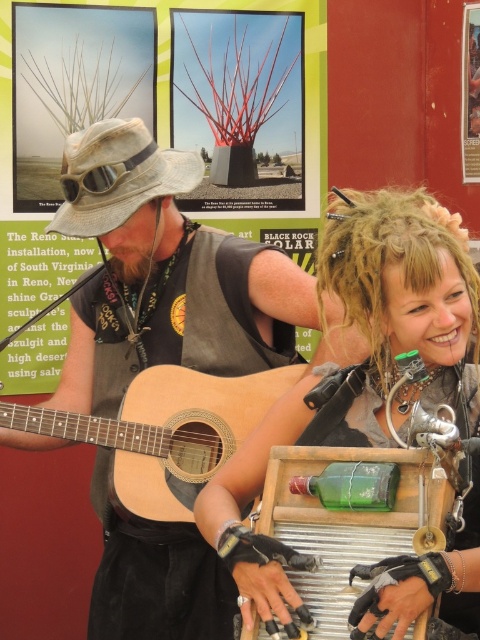
Between point (142, 122) and point (144, 161), which one is positioned behind?

The point (142, 122) is more distant.

Which is more to the left, light brown straw hat at center or matte black goggles at center?

From the viewer's perspective, light brown straw hat at center appears more on the left side.

Which is behind, point (130, 204) or point (134, 192)?

Point (134, 192)

Find the location of a particular element. Image resolution: width=480 pixels, height=640 pixels. light brown straw hat at center is located at coordinates (117, 177).

Is natural wood acoustic guitar at center above matte black goggles at center?

No, natural wood acoustic guitar at center is not above matte black goggles at center.

Between natural wood acoustic guitar at center and matte black goggles at center, which one is positioned higher?

matte black goggles at center is above.

You are a GUI agent. You are given a task and a screenshot of the screen. Output one action in this format:
    pyautogui.click(x=<x>, y=<y>)
    Task: Click on the natural wood acoustic guitar at center
    The image size is (480, 640).
    Given the screenshot: What is the action you would take?
    pyautogui.click(x=165, y=433)

Looking at this image, between curly blonde hair at upper right and matte black goggles at center, which one is positioned higher?

matte black goggles at center is higher up.

How much distance is there between curly blonde hair at upper right and matte black goggles at center?

The distance of curly blonde hair at upper right from matte black goggles at center is 1.13 meters.

Does point (360, 323) come closer to viewer compared to point (124, 157)?

Yes.

You are a GUI agent. You are given a task and a screenshot of the screen. Output one action in this format:
    pyautogui.click(x=<x>, y=<y>)
    Task: Click on the curly blonde hair at upper right
    The image size is (480, 640).
    Given the screenshot: What is the action you would take?
    pyautogui.click(x=385, y=259)